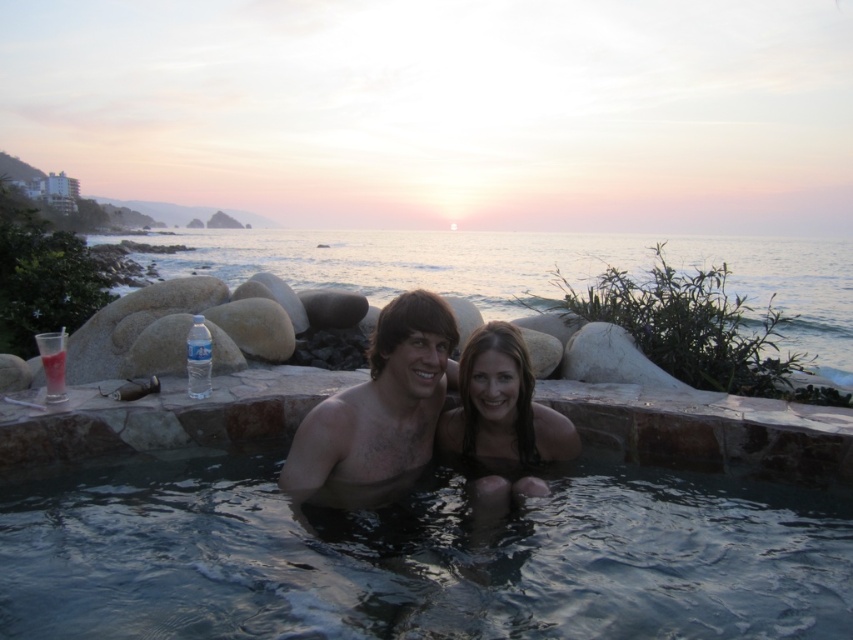
Which is in front, point (200, 273) or point (351, 464)?

Point (351, 464)

Who is more forward, (553, 243) or (372, 490)?

Point (372, 490) is more forward.

This screenshot has width=853, height=640. Identify the location of clear water at center. (x=534, y=269).

Does clear water at center have a greater width compared to smooth skin girl at center?

Yes.

Which is in front, point (822, 346) or point (560, 420)?

Point (560, 420) is more forward.

Locate an element on the screen. clear water at center is located at coordinates (534, 269).

Is clear glass pool at center below smooth skin girl at center?

Yes, clear glass pool at center is below smooth skin girl at center.

Who is positioned more to the right, clear glass pool at center or smooth skin girl at center?

smooth skin girl at center

What do you see at coordinates (419, 557) in the screenshot? This screenshot has height=640, width=853. I see `clear glass pool at center` at bounding box center [419, 557].

Find the location of a particular element. This screenshot has height=640, width=853. clear glass pool at center is located at coordinates (419, 557).